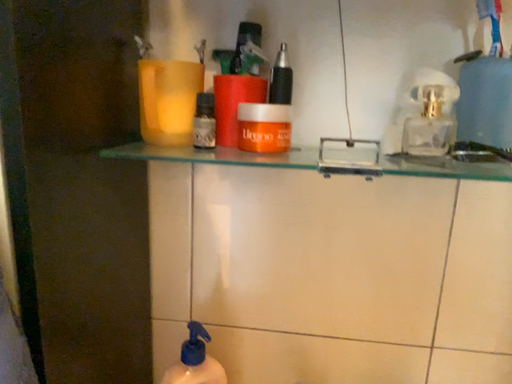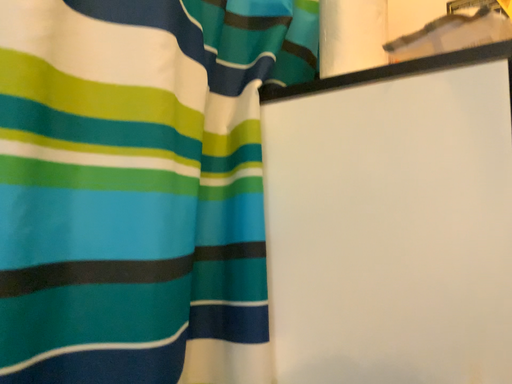
Question: How did the camera likely rotate when shooting the video?

Choices:
 (A) rotated left
 (B) rotated right

Answer: (A)